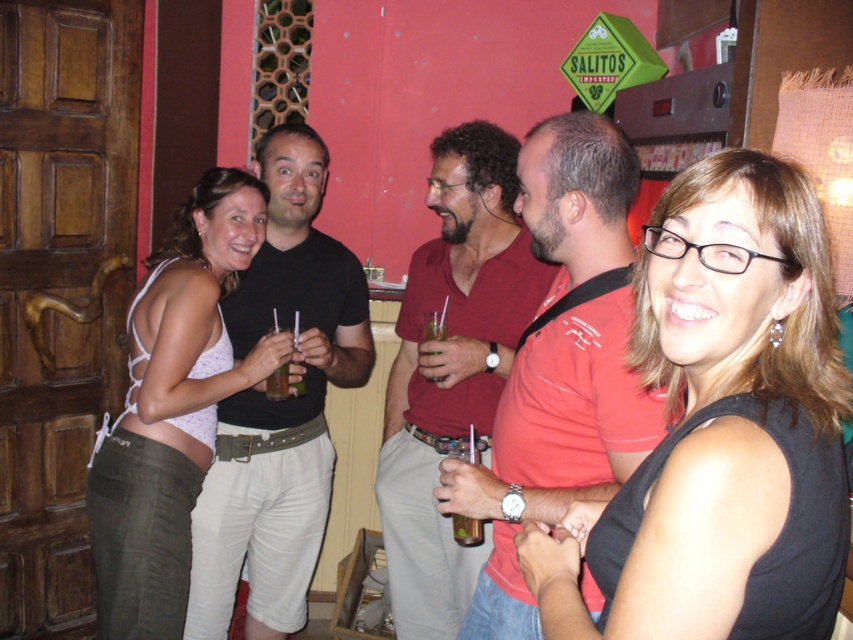
Which is more to the left, matte white tank top at center or clear plastic cup at center?

matte white tank top at center

The image size is (853, 640). Find the location of `matte white tank top at center`. matte white tank top at center is located at coordinates (173, 406).

Locate an element on the screen. This screenshot has height=640, width=853. matte white tank top at center is located at coordinates [173, 406].

Does matte white tank top at center have a lesser width compared to translucent plastic cup at center?

No, matte white tank top at center is not thinner than translucent plastic cup at center.

This screenshot has width=853, height=640. I want to click on matte white tank top at center, so click(x=173, y=406).

Locate an element on the screen. This screenshot has height=640, width=853. matte white tank top at center is located at coordinates (173, 406).

Who is shorter, red cotton shirt at center or matte white tank top at center?

With less height is red cotton shirt at center.

Image resolution: width=853 pixels, height=640 pixels. What do you see at coordinates (560, 365) in the screenshot? I see `red cotton shirt at center` at bounding box center [560, 365].

Where is `red cotton shirt at center`? This screenshot has height=640, width=853. red cotton shirt at center is located at coordinates (560, 365).